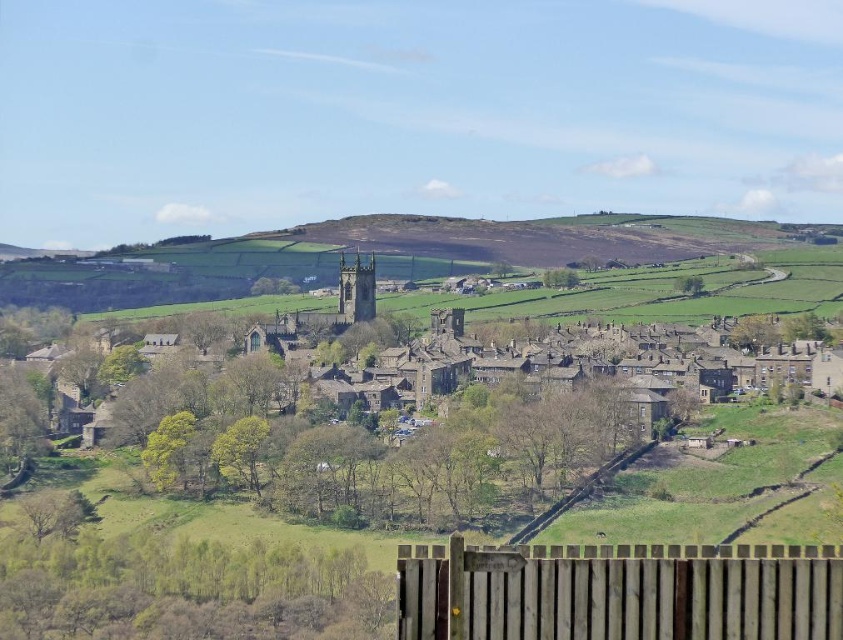
Looking at this image, you are standing at the point marked as point (446,369) in the image. What is the nearest object to you in the village scene?

The nearest object to you at point (446,369) is the brown stone buildings at center, as the coordinates provided correspond to their location.